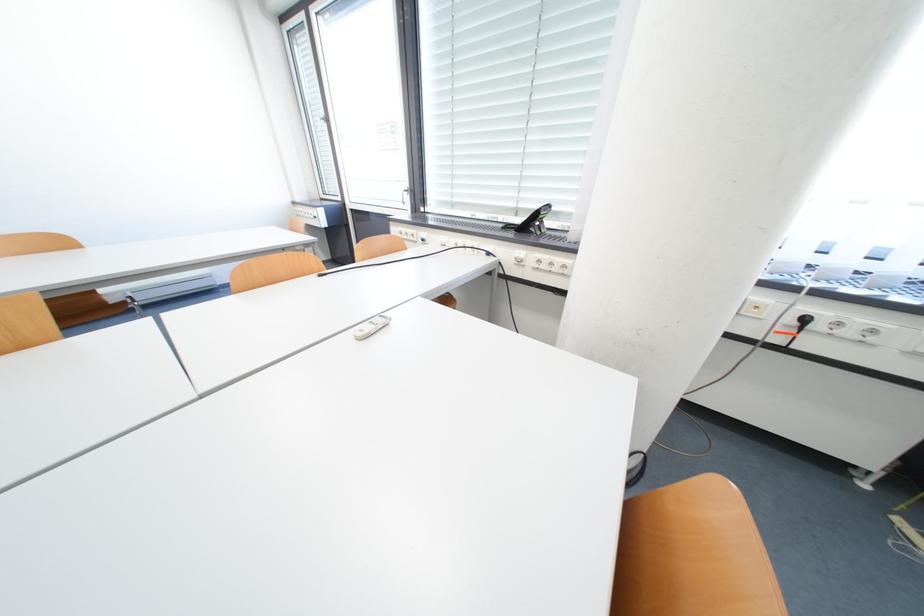
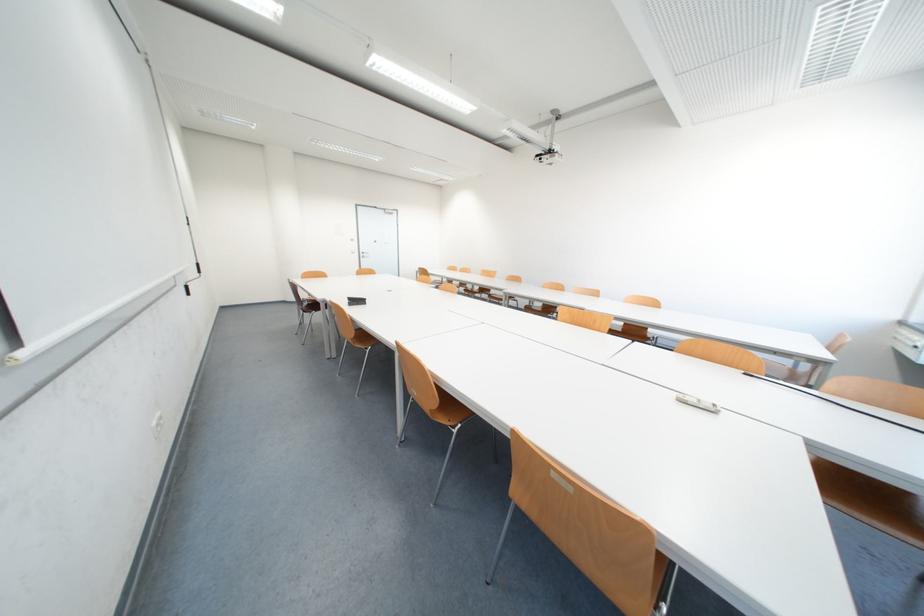
Locate, in the second image, the point that corresponds to point 378,329 in the first image.

(701, 400)